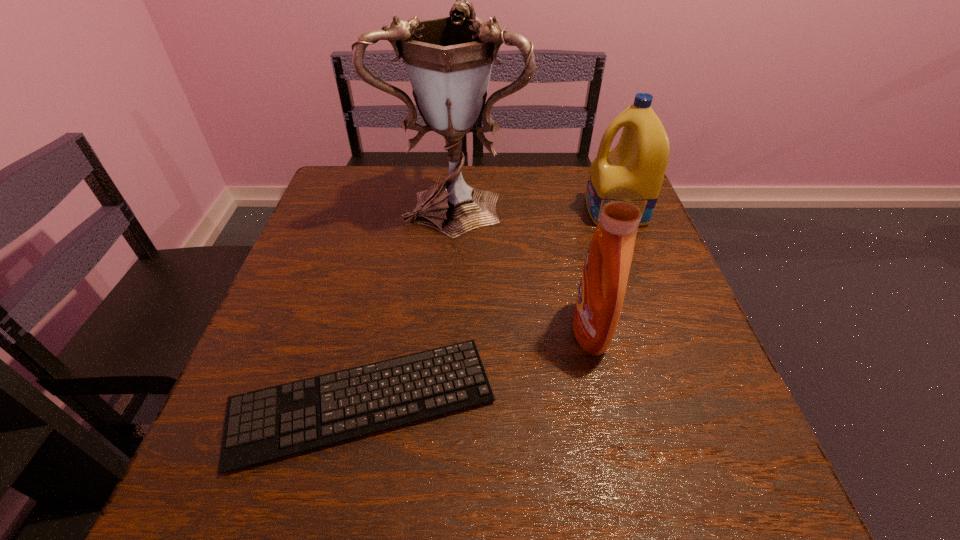
I want to click on object that is at the far right corner, so [x=639, y=161].

Identify the location of vacant region at the far edge. The height and width of the screenshot is (540, 960). (511, 197).

Find the location of a particular element. vacant space at the near edge is located at coordinates (433, 487).

In the image, there is a desktop. In order to click on free region at the left edge in this screenshot , I will do `click(322, 302)`.

Identify the location of blank space at the right edge. The width and height of the screenshot is (960, 540). (591, 229).

Image resolution: width=960 pixels, height=540 pixels. Identify the location of free location at the far left corner. (367, 205).

Image resolution: width=960 pixels, height=540 pixels. Identify the location of vacant region between the tallest object and the farther detergent. (536, 206).

This screenshot has height=540, width=960. What are the coordinates of `vacant area between the computer keyboard and the farther detergent` in the screenshot? It's located at (490, 307).

Identify the location of blank region between the shortest object and the rightmost object. The height and width of the screenshot is (540, 960). (490, 307).

Where is `free space between the tallest object and the rightmost object`? Image resolution: width=960 pixels, height=540 pixels. free space between the tallest object and the rightmost object is located at coordinates (536, 206).